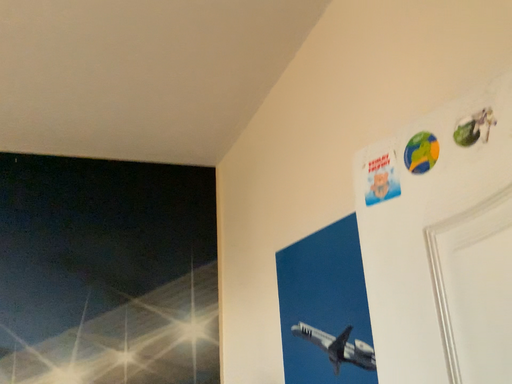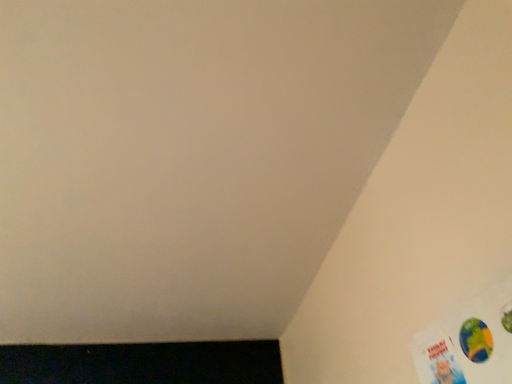
Question: Which way did the camera rotate in the video?

Choices:
 (A) rotated right
 (B) rotated left

Answer: (B)